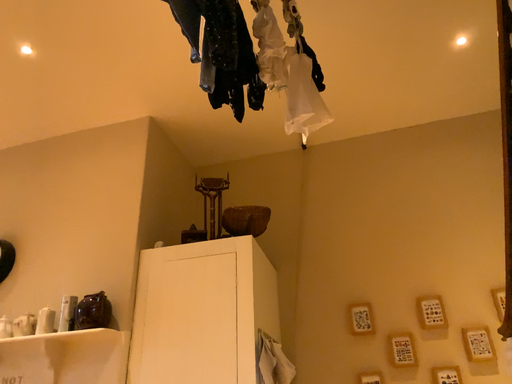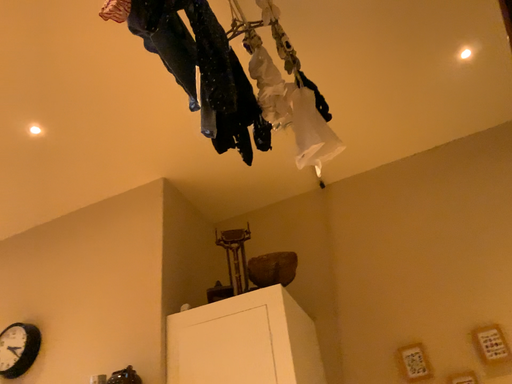
Question: Which way did the camera rotate in the video?

Choices:
 (A) rotated downward
 (B) rotated upward

Answer: (B)